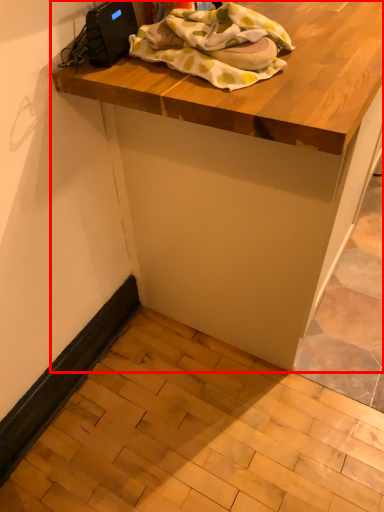
Question: From the image's perspective, where is table (annotated by the red box) located relative to blanket?

Choices:
 (A) above
 (B) below

Answer: (A)